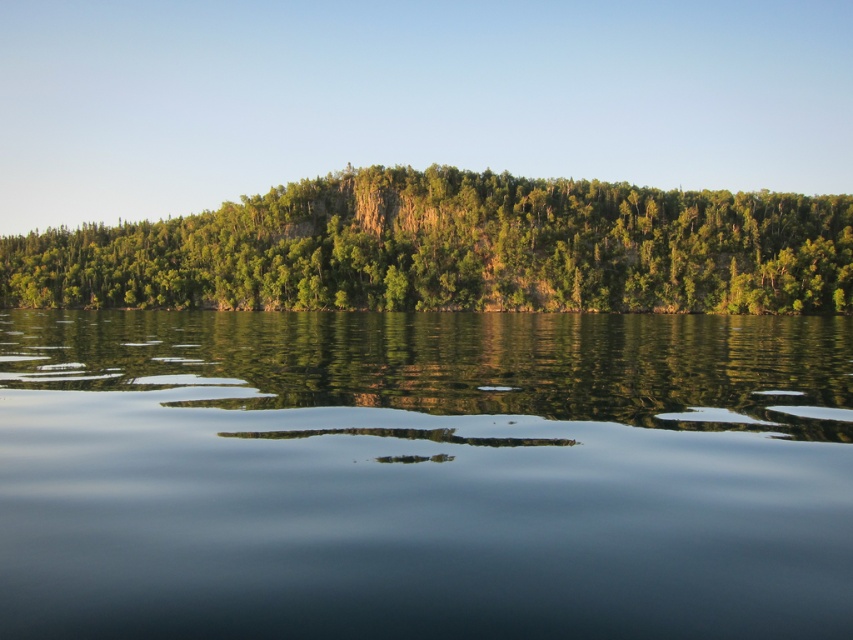
You are standing at the edge of the water and want to take a photo. Which object, the smooth dark water at center or the green leafy trees at center, will appear larger in your camera viewfinder?

The smooth dark water at center will appear larger in the camera viewfinder because it is closer to the viewer than the green leafy trees at center.

You are standing at the edge of the scene and want to walk towards the smooth dark water at center and the green leafy trees at center. Which object will you encounter first?

The green leafy trees at center are positioned on the left side of the smooth dark water at center, so you will encounter the green leafy trees at center first as you walk towards them.

You are standing at the point marked as point (x=424, y=474) in the image. What type of surface are you currently standing on?

You are standing on the smooth dark water at center, which is located at point (x=424, y=474).